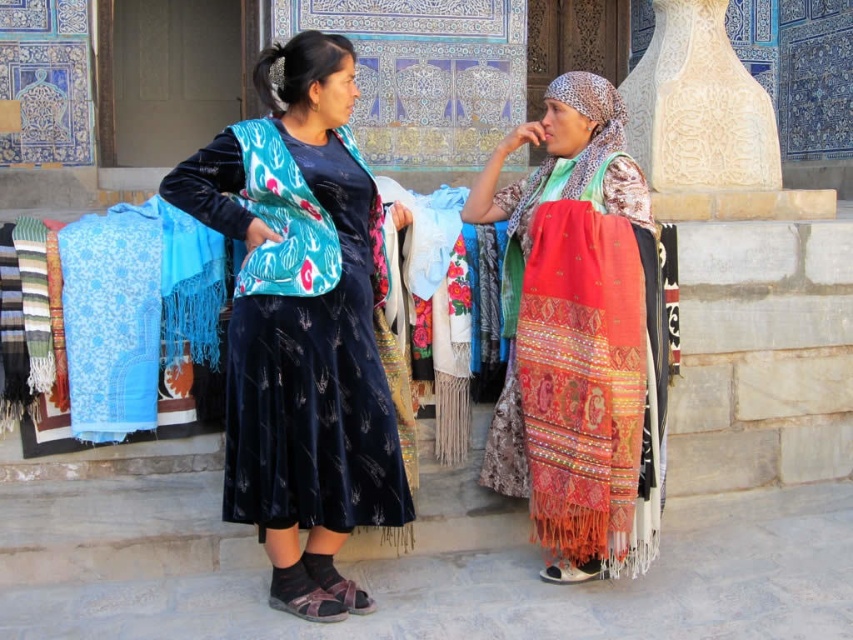
You are a photographer trying to capture a photo of the two women. You want to ensure that the velvet blue dress at center and the red woven shawl at right are both clearly visible in the frame. Based on their positions, which object is closer to the left edge of the photo?

The velvet blue dress at center is to the left of the red woven shawl at right, so the velvet blue dress at center will be closer to the left edge of the photo.

You are a photographer standing at the camera position. You want to take a closeup shot of the embroidered silk scarf at center. Can you reach it with your 100mm lens? Explain why or why not.

The embroidered silk scarf at center is 14.83 meters away from the camera. A 100mm lens has a focal length that is suitable for capturing subjects at that distance, so yes, you can take a closeup shot with your 100mm lens.